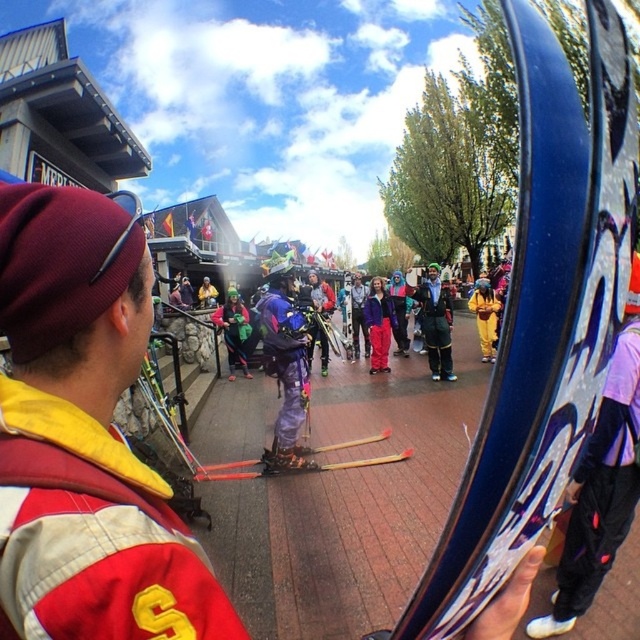
Is point (426, 307) positioned behind point (371, 348)?

No, (426, 307) is in front of (371, 348).

Between point (429, 321) and point (392, 307), which one is positioned in front?

Positioned in front is point (429, 321).

This screenshot has height=640, width=640. I want to click on shiny metallic jacket at center, so click(435, 323).

Can you confirm if purple matte ski pants at center is taller than yellow fabric pants at center?

Yes.

Which is in front, point (292, 452) or point (483, 300)?

Positioned in front is point (292, 452).

This screenshot has height=640, width=640. Find the location of `purple matte ski pants at center`. purple matte ski pants at center is located at coordinates (285, 365).

Is the position of purple matte ski pants at center less distant than that of matte purple jacket at center?

That is True.

Who is more forward, (307, 394) or (365, 323)?

Point (307, 394) is in front.

Who is more distant from viewer, (284, 388) or (365, 296)?

Point (365, 296)

Identify the location of purple matte ski pants at center. Image resolution: width=640 pixels, height=640 pixels. (285, 365).